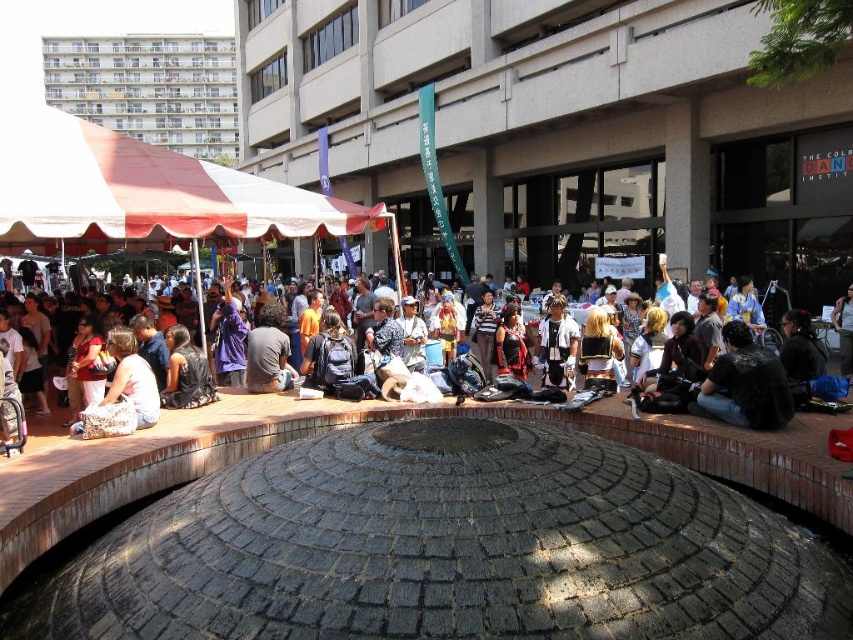
You are at the public square and see two jackets at the center of the image. Which jacket is closer to you, the dark gray leather jacket at center or the white matte jacket at center?

The dark gray leather jacket at center is closer to you because it is in front of the white matte jacket at center.

You are at the plaza and want to retrieve your white fabric bag at center and matte black backpack at center. Which item is closer to you if you are standing in the middle of the paved area?

The white fabric bag at center is closer to you since it is in front of the matte black backpack at center.

You are standing in the public square and want to locate the white fabric canopy at upper left. According to the coordinates provided, where should you look relative to the center of the image?

The white fabric canopy at upper left is located at coordinates point (142, 189), which is to the left and slightly above the center of the image.